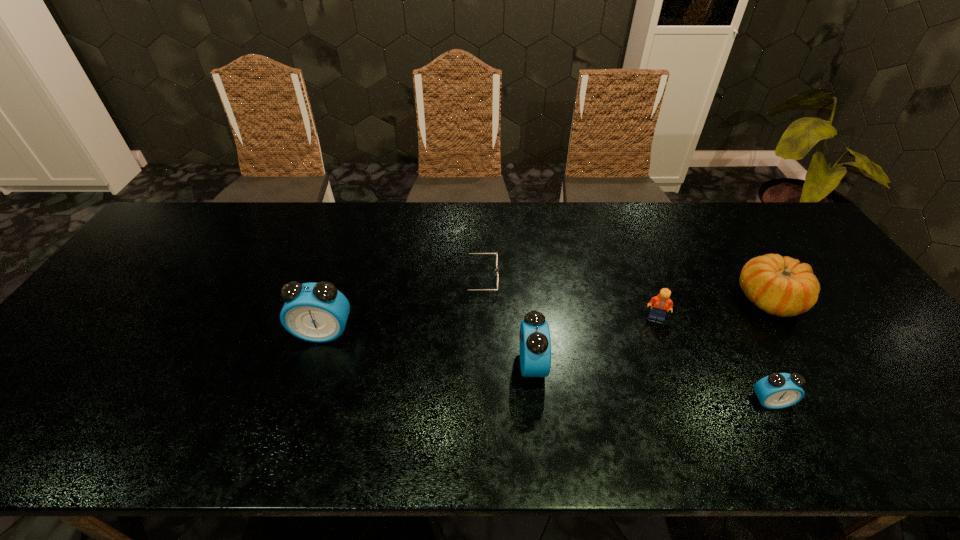
You are a GUI agent. You are given a task and a screenshot of the screen. Output one action in this format:
    pyautogui.click(x=<x>, y=<y>)
    Task: Click on the vacant space located on the face of the second shortest alarm clock
    
    Given the screenshot: What is the action you would take?
    pyautogui.click(x=635, y=365)

Find the location of a particular element. The height and width of the screenshot is (540, 960). vacant space located 0.120m on the front-facing side of the fourth object from left to right is located at coordinates (673, 359).

Locate an element on the screen. vacant space located 0.070m on the right of the rightmost object is located at coordinates (828, 300).

Where is `blank area located on the front-facing side of the fifth object from right to left`? The image size is (960, 540). blank area located on the front-facing side of the fifth object from right to left is located at coordinates (601, 278).

Where is `object positioned at the right edge`? This screenshot has height=540, width=960. object positioned at the right edge is located at coordinates (781, 286).

The width and height of the screenshot is (960, 540). I want to click on vacant area at the far edge, so click(294, 203).

Image resolution: width=960 pixels, height=540 pixels. In order to click on vacant space at the near edge of the desktop in this screenshot , I will do `click(156, 411)`.

Image resolution: width=960 pixels, height=540 pixels. Identify the location of vacant space at the left edge of the desktop. (140, 279).

At what (x,y) coordinates should I click in order to perform the action: click on free region at the far left corner. Please return your answer as a coordinate pair (x, y). This screenshot has width=960, height=540. Looking at the image, I should click on pos(170,221).

In the image, there is a desktop. Where is `vacant space at the far right corner`? The image size is (960, 540). vacant space at the far right corner is located at coordinates (795, 244).